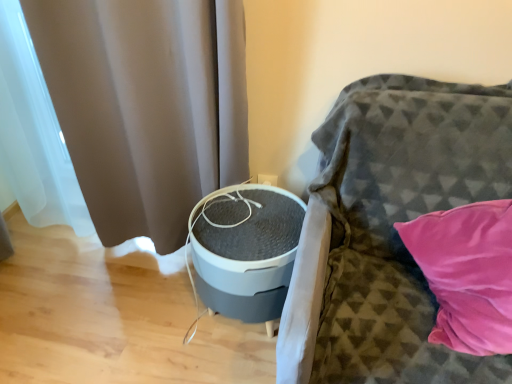
Question: Is textured gray sofa at right to the left or to the right of matte gray curtain at left in the image?

Choices:
 (A) left
 (B) right

Answer: (B)

Question: Does point (334, 289) appear closer or farther from the camera than point (229, 8)?

Choices:
 (A) farther
 (B) closer

Answer: (B)

Question: Is textured gray sofa at right situated inside matte gray curtain at left or outside?

Choices:
 (A) inside
 (B) outside

Answer: (B)

Question: Do you think matte gray curtain at left is within textured gray sofa at right, or outside of it?

Choices:
 (A) outside
 (B) inside

Answer: (A)

Question: In terms of width, does matte gray curtain at left look wider or thinner when compared to textured gray sofa at right?

Choices:
 (A) thin
 (B) wide

Answer: (A)

Question: Visually, is matte gray curtain at left positioned to the left or to the right of textured gray sofa at right?

Choices:
 (A) left
 (B) right

Answer: (A)

Question: From a real-world perspective, relative to textured gray sofa at right, is matte gray curtain at left vertically above or below?

Choices:
 (A) below
 (B) above

Answer: (B)